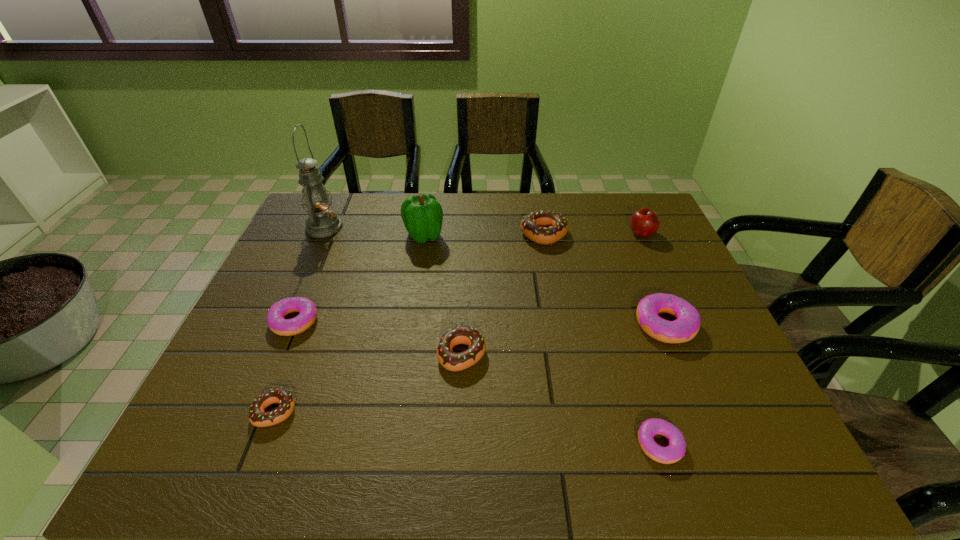
Where is `object that is the seventh nearest to the fifth object from right to left`? This screenshot has width=960, height=540. object that is the seventh nearest to the fifth object from right to left is located at coordinates (322, 222).

Select which doughnut is the fourth closest to the shortest object. Please provide its 2D coordinates. Your answer should be formatted as a tuple, i.e. [(x, y)], where the tuple contains the x and y coordinates of a point satisfying the conditions above.

[(257, 416)]

I want to click on doughnut that is the fourth closest to the shortest doughnut, so click(x=257, y=416).

Locate an element on the screen. Image resolution: width=960 pixels, height=540 pixels. the second closest brown doughnut to the second biggest pink doughnut is located at coordinates (452, 361).

Select which brown doughnut is the second closest to the farthest brown doughnut. Please provide its 2D coordinates. Your answer should be formatted as a tuple, i.e. [(x, y)], where the tuple contains the x and y coordinates of a point satisfying the conditions above.

[(257, 416)]

You are a GUI agent. You are given a task and a screenshot of the screen. Output one action in this format:
    pyautogui.click(x=<x>, y=<y>)
    Task: Click on the pink doughnut that is the second closest to the biggest pink doughnut
    This screenshot has width=960, height=540.
    Given the screenshot: What is the action you would take?
    pyautogui.click(x=307, y=309)

At what (x,y) coordinates should I click in order to perform the action: click on pink doughnut identified as the closest to the tallest object. Please return your answer as a coordinate pair (x, y). The height and width of the screenshot is (540, 960). Looking at the image, I should click on (307, 309).

Find the location of a particular element. The image size is (960, 540). vacant space that satisfies the following two spatial constraints: 1. on the front side of the green bell pepper; 2. on the right side of the fifth object from right to left is located at coordinates (405, 354).

Locate an element on the screen. This screenshot has height=540, width=960. free location that satisfies the following two spatial constraints: 1. on the back side of the third doughnut from right to left; 2. on the left side of the pink apple is located at coordinates (543, 233).